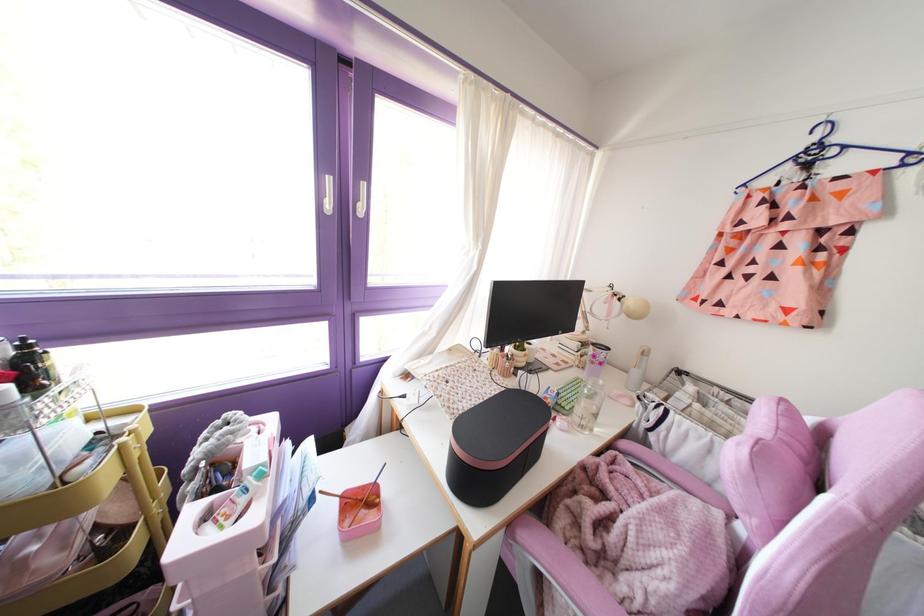
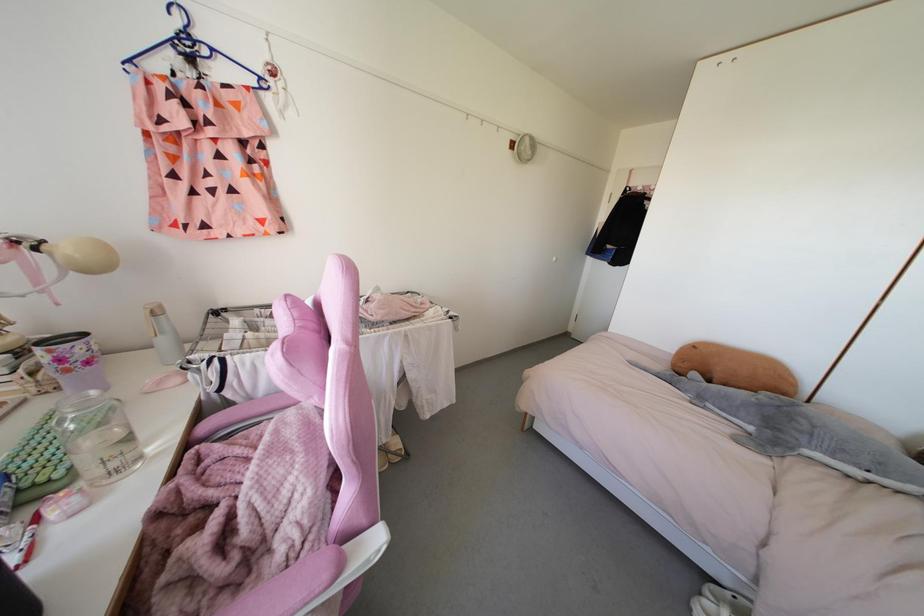
Find the pixel in the second image that matches the point at 610,553 in the first image.

(252, 543)